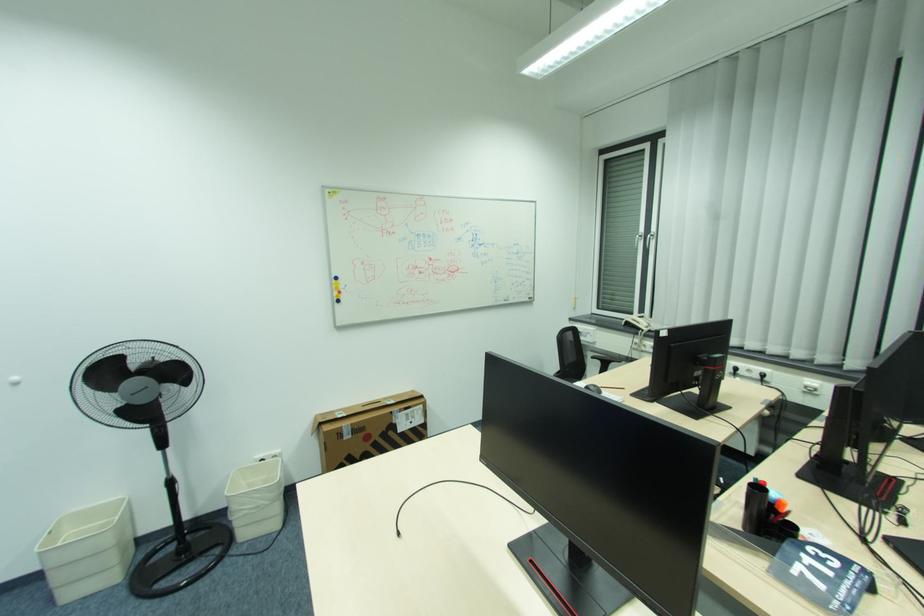
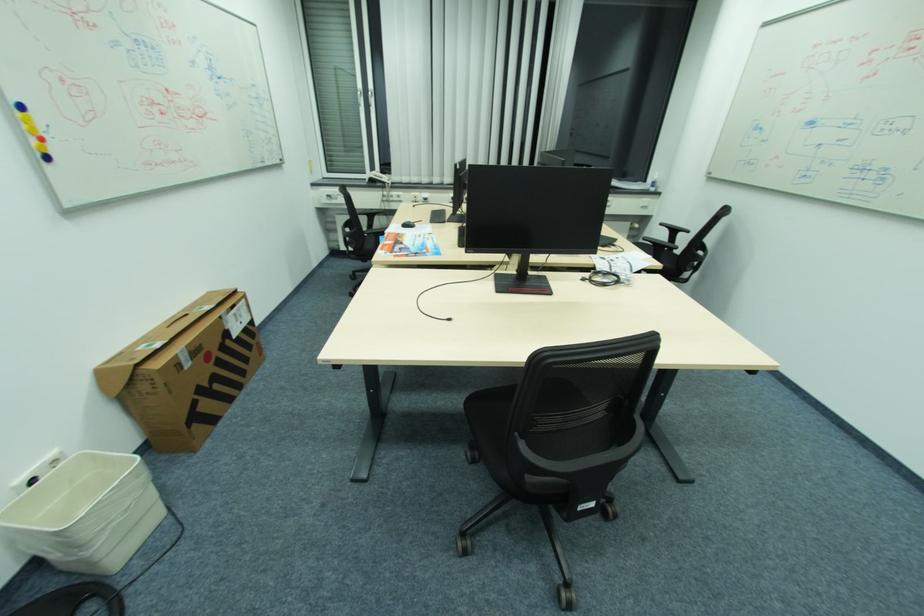
In the second image, find the point that corresponds to (275,492) in the first image.

(143, 476)